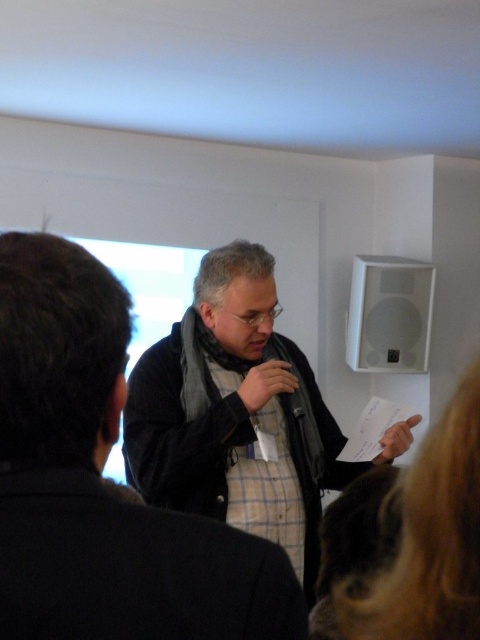
Does matte black jacket at center have a smaller size compared to blonde hair at lower right?

Actually, matte black jacket at center might be larger than blonde hair at lower right.

Describe the element at coordinates (240, 416) in the screenshot. This screenshot has width=480, height=640. I see `matte black jacket at center` at that location.

You are a GUI agent. You are given a task and a screenshot of the screen. Output one action in this format:
    pyautogui.click(x=<x>, y=<y>)
    Task: Click on the matte black jacket at center
    The width and height of the screenshot is (480, 640).
    Given the screenshot: What is the action you would take?
    pyautogui.click(x=240, y=416)

Can you confirm if dark gray fabric jacket at center is positioned to the right of matte black jacket at center?

In fact, dark gray fabric jacket at center is to the left of matte black jacket at center.

Is dark gray fabric jacket at center below matte black jacket at center?

No.

Identify the location of dark gray fabric jacket at center. (99, 483).

Does dark gray fabric jacket at center appear on the right side of blonde hair at lower right?

In fact, dark gray fabric jacket at center is to the left of blonde hair at lower right.

Which is more to the right, dark gray fabric jacket at center or blonde hair at lower right?

From the viewer's perspective, blonde hair at lower right appears more on the right side.

Is point (129, 304) behind point (394, 616)?

Yes.

Locate an element on the screen. Image resolution: width=480 pixels, height=640 pixels. dark gray fabric jacket at center is located at coordinates (99, 483).